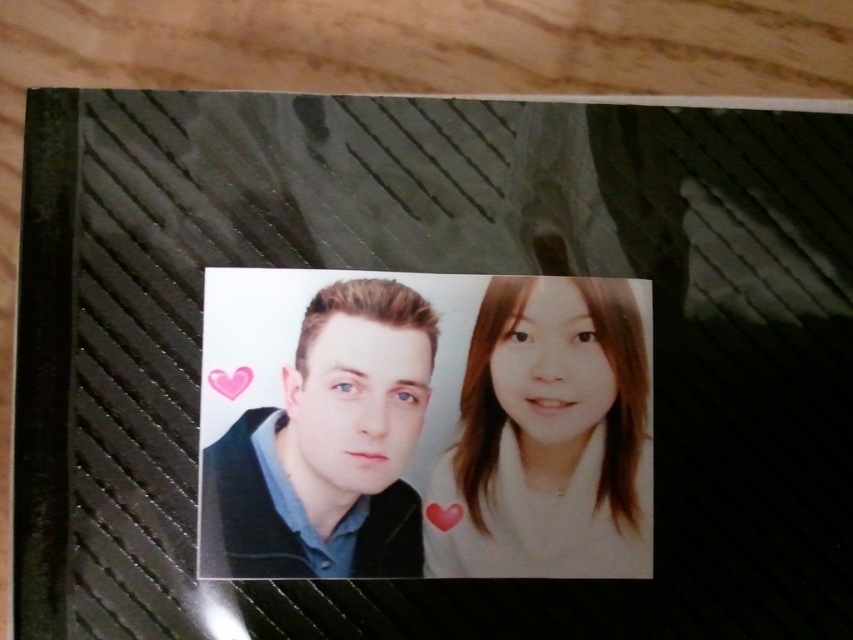
Does white matte hair at center have a greater height compared to matte black sweater at center?

Indeed, white matte hair at center has a greater height compared to matte black sweater at center.

Does point (527, 556) come closer to viewer compared to point (280, 577)?

No, (527, 556) is behind (280, 577).

The height and width of the screenshot is (640, 853). I want to click on white matte hair at center, so click(548, 436).